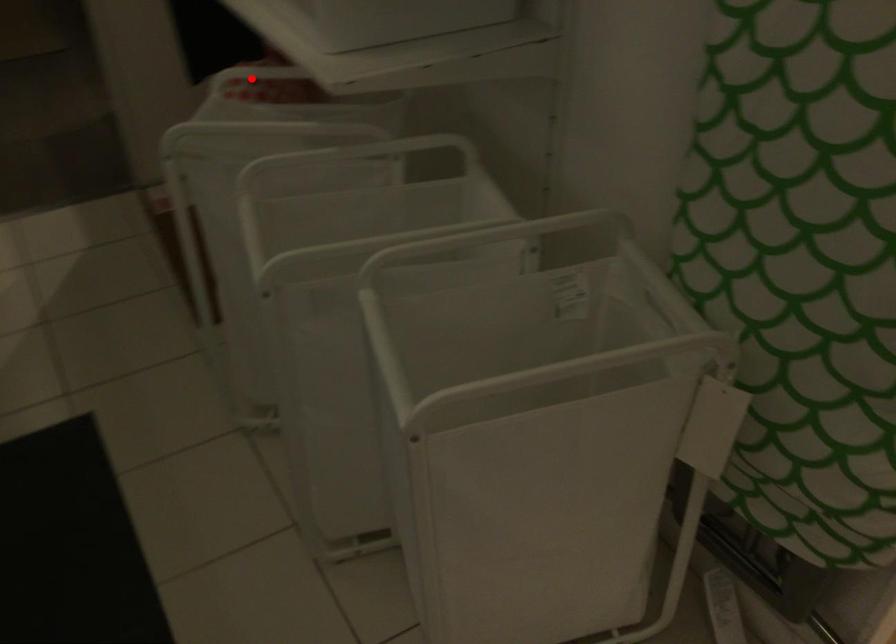
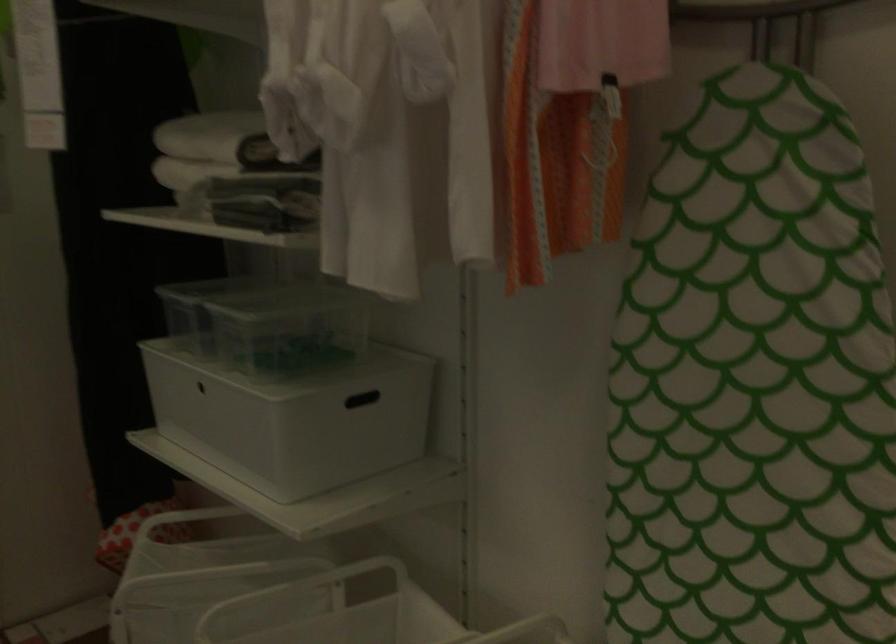
Question: I am providing you with two images of the same scene from different viewpoints. A red point is marked on the first image. Is the red point's position out of view in image 2?

Choices:
 (A) Yes
 (B) No

Answer: (B)